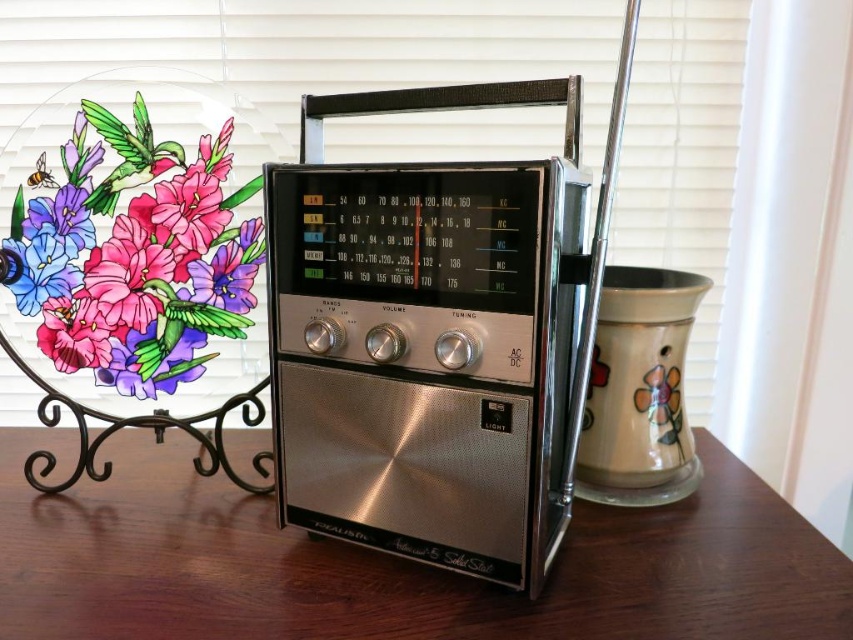
You are setting up a small display on a shelf and want to place the silver metallic radio at center and the matte glass plate with floral design at left. The shelf is only 10 inches wide. Will both items fit side by side without overlapping?

The distance between the silver metallic radio at center and matte glass plate with floral design at left is 7.75 inches, so they can fit on a 10 inch wide shelf since 7.75 is less than 10. However, this assumes no additional space is needed between them. If you want some space between them, the total width might exceed 10 inches.

You are arranging items on the satin wood table at center and the matte glass plate with floral design at left. If you want to place a small vase between them, will it fit in the space between the two objects?

The satin wood table at center is in front of the matte glass plate with floral design at left, meaning there is space between them. A small vase should fit between the two objects.